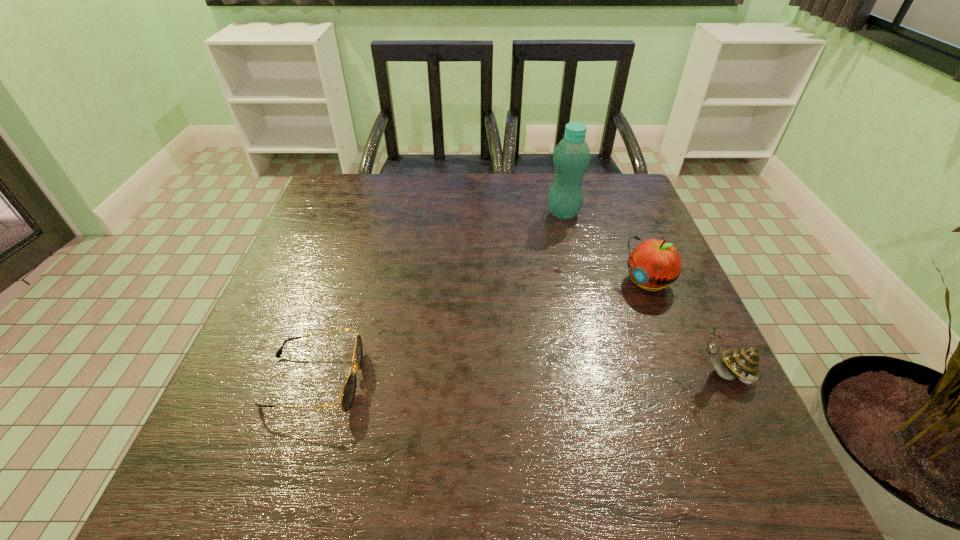
You are a GUI agent. You are given a task and a screenshot of the screen. Output one action in this format:
    pyautogui.click(x=<x>, y=<y>)
    Task: Click on the object that stands as the second closest to the snail
    This screenshot has width=960, height=540.
    Given the screenshot: What is the action you would take?
    pyautogui.click(x=571, y=157)

The width and height of the screenshot is (960, 540). Find the location of `object that is the second closest to the shortest object`. object that is the second closest to the shortest object is located at coordinates (571, 157).

You are a GUI agent. You are given a task and a screenshot of the screen. Output one action in this format:
    pyautogui.click(x=<x>, y=<y>)
    Task: Click on the vacant area in the image that satisfies the following two spatial constraints: 1. on the front side of the snail; 2. on the face of the tallest object
    The height and width of the screenshot is (540, 960).
    Given the screenshot: What is the action you would take?
    pyautogui.click(x=602, y=375)

The height and width of the screenshot is (540, 960). In order to click on vacant region that satisfies the following two spatial constraints: 1. on the front side of the snail; 2. on the face of the apple in this screenshot , I will do `click(684, 375)`.

Locate an element on the screen. Image resolution: width=960 pixels, height=540 pixels. free region that satisfies the following two spatial constraints: 1. on the front side of the snail; 2. on the face of the water bottle is located at coordinates click(602, 375).